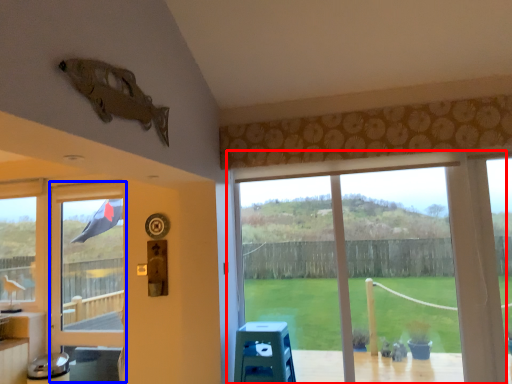
Question: Which object is closer to the camera taking this photo, window (highlighted by a red box) or screen door (highlighted by a blue box)?

Choices:
 (A) window
 (B) screen door

Answer: (A)